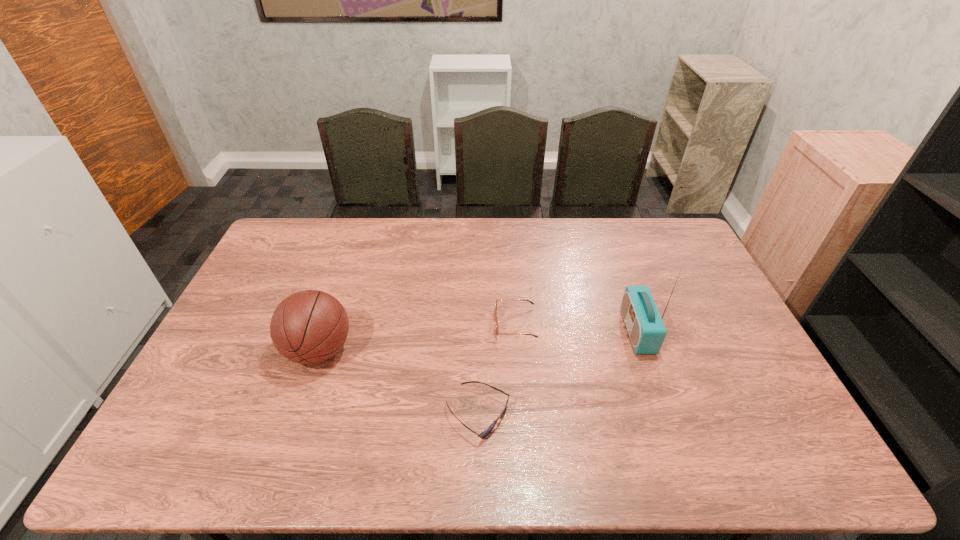
You are a GUI agent. You are given a task and a screenshot of the screen. Output one action in this format:
    pyautogui.click(x=<x>, y=<y>)
    Task: Click on the unoccupied position between the nearest object and the basketball
    The width and height of the screenshot is (960, 540).
    Given the screenshot: What is the action you would take?
    pyautogui.click(x=398, y=383)

Image resolution: width=960 pixels, height=540 pixels. I want to click on free space between the radio receiver and the taller sunglasses, so click(576, 327).

Identify which object is the second nearest to the third tallest object. Please provide its 2D coordinates. Your answer should be formatted as a tuple, i.e. [(x, y)], where the tuple contains the x and y coordinates of a point satisfying the conditions above.

[(644, 324)]

At what (x,y) coordinates should I click in order to perform the action: click on object that is the second closest to the tallest object. Please return your answer as a coordinate pair (x, y). Image resolution: width=960 pixels, height=540 pixels. Looking at the image, I should click on (482, 435).